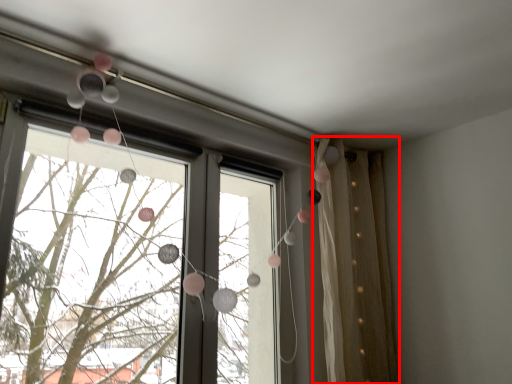
Question: Where is curtain (annotated by the red box) located in relation to window in the image?

Choices:
 (A) right
 (B) left

Answer: (A)